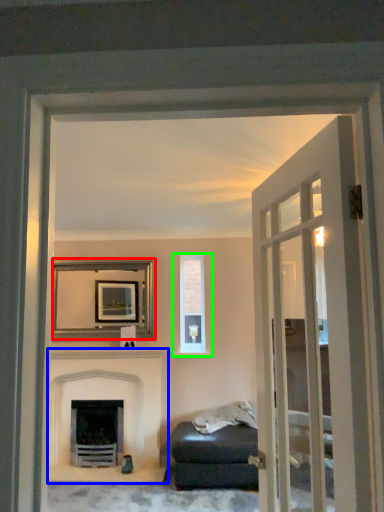
Question: Which is nearer to the picture frame (highlighted by a red box)? fireplace (highlighted by a blue box) or window (highlighted by a green box).

Choices:
 (A) fireplace
 (B) window

Answer: (A)